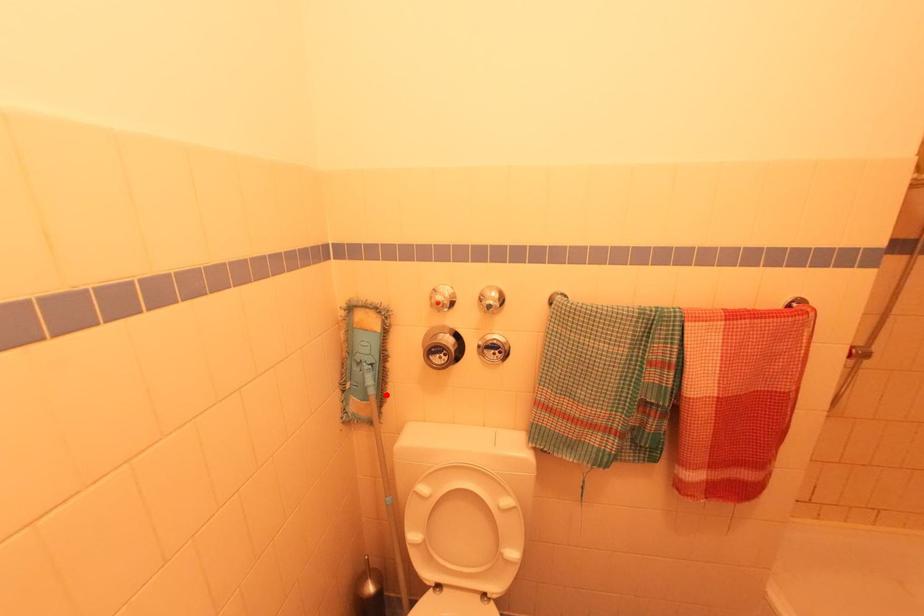
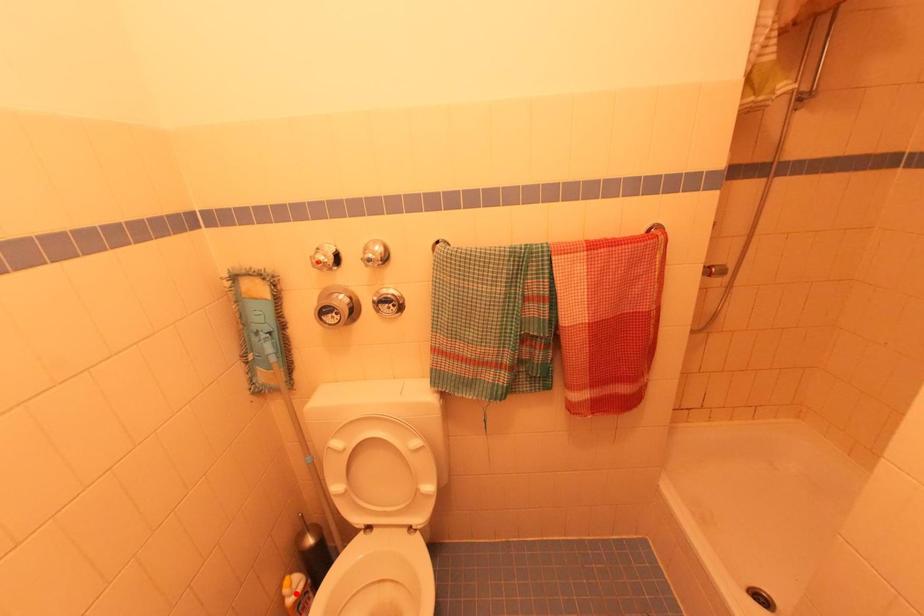
Based on the photo, I am providing you with two images of the same scene from different viewpoints. A red point is marked on the first image and another point is marked on the second image. Are the points marked in image1 and image2 representing the same 3D position?

No